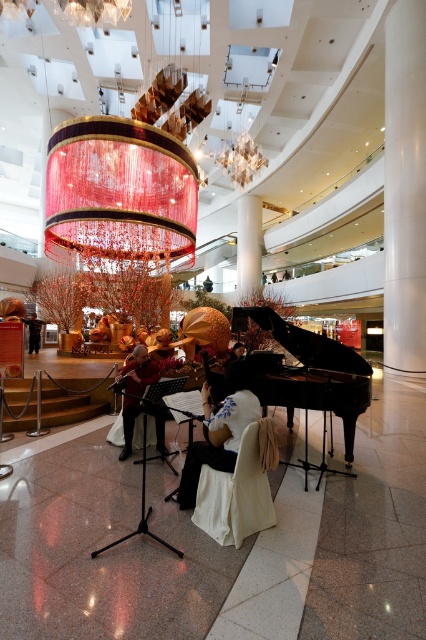
Question: Which of the following is the farthest from the observer?

Choices:
 (A) white satin dress at center
 (B) black polished piano at center

Answer: (B)

Question: Does black polished piano at center have a greater width compared to dark brown leather jacket at center?

Choices:
 (A) no
 (B) yes

Answer: (B)

Question: Which of the following is the farthest from the observer?

Choices:
 (A) (275, 333)
 (B) (230, 380)
 (C) (36, 323)

Answer: (C)

Question: Does white satin dress at center have a greater width compared to dark brown leather jacket at center?

Choices:
 (A) yes
 (B) no

Answer: (B)

Question: In this image, where is white satin dress at center located relative to dark brown leather jacket at center?

Choices:
 (A) below
 (B) above

Answer: (A)

Question: Which object is the closest to the black polished piano at center?

Choices:
 (A) matte red violin at center
 (B) white satin dress at center

Answer: (B)